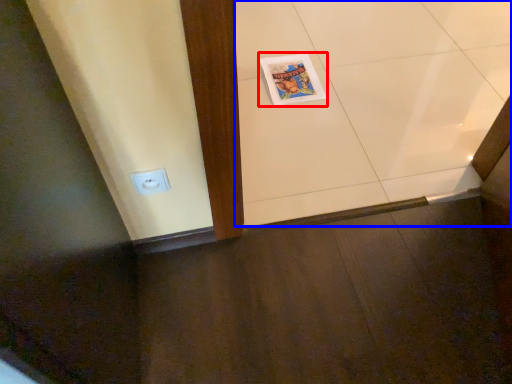
Question: Which object is closer to the camera taking this photo, comic book (highlighted by a red box) or ceramic tile (highlighted by a blue box)?

Choices:
 (A) comic book
 (B) ceramic tile

Answer: (B)